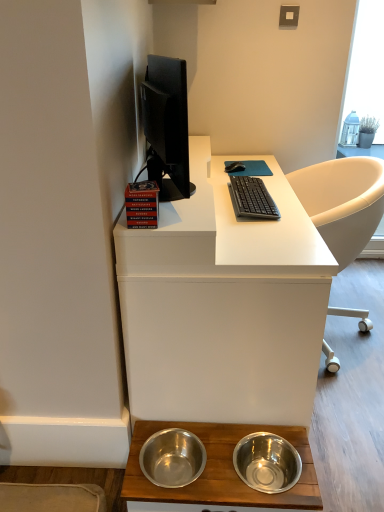
Question: Is black plastic keyboard at center at the right side of black rubber mouse at center?

Choices:
 (A) yes
 (B) no

Answer: (A)

Question: Considering the relative sizes of black plastic keyboard at center and black rubber mouse at center in the image provided, is black plastic keyboard at center smaller than black rubber mouse at center?

Choices:
 (A) yes
 (B) no

Answer: (B)

Question: From a real-world perspective, is black plastic keyboard at center positioned under black rubber mouse at center based on gravity?

Choices:
 (A) no
 (B) yes

Answer: (B)

Question: Does black plastic keyboard at center lie in front of black rubber mouse at center?

Choices:
 (A) no
 (B) yes

Answer: (B)

Question: Are black plastic keyboard at center and black rubber mouse at center located far from each other?

Choices:
 (A) no
 (B) yes

Answer: (A)

Question: In terms of height, does stainless steel bowls at lower center, marked as the 1th desk in a bottom-to-top arrangement, look taller or shorter compared to white matte desk at center, which appears as the first desk when viewed from the top?

Choices:
 (A) short
 (B) tall

Answer: (A)

Question: From a real-world perspective, is stainless steel bowls at lower center, which is the second desk from top to bottom, physically located above or below white matte desk at center, arranged as the 2th desk when ordered from the bottom?

Choices:
 (A) above
 (B) below

Answer: (B)

Question: Relative to white matte desk at center, which appears as the first desk when viewed from the top, is stainless steel bowls at lower center, which is the second desk from top to bottom, in front or behind?

Choices:
 (A) behind
 (B) front

Answer: (A)

Question: Considering the positions of point (148, 431) and point (139, 300), is point (148, 431) closer or farther from the camera than point (139, 300)?

Choices:
 (A) closer
 (B) farther

Answer: (B)

Question: Is white matte desk at center, arranged as the 2th desk when ordered from the bottom, spatially inside stainless steel bowls at lower center, marked as the 1th desk in a bottom-to-top arrangement, or outside of it?

Choices:
 (A) inside
 (B) outside

Answer: (B)

Question: Would you say white matte desk at center, which appears as the first desk when viewed from the top, is to the left or to the right of stainless steel bowls at lower center, marked as the 1th desk in a bottom-to-top arrangement, in the picture?

Choices:
 (A) right
 (B) left

Answer: (A)

Question: Considering the positions of white matte desk at center, arranged as the 2th desk when ordered from the bottom, and stainless steel bowls at lower center, marked as the 1th desk in a bottom-to-top arrangement, in the image, is white matte desk at center, arranged as the 2th desk when ordered from the bottom, taller or shorter than stainless steel bowls at lower center, marked as the 1th desk in a bottom-to-top arrangement,?

Choices:
 (A) tall
 (B) short

Answer: (A)

Question: Is white matte desk at center, which appears as the first desk when viewed from the top, in front of or behind stainless steel bowls at lower center, which is the second desk from top to bottom, in the image?

Choices:
 (A) front
 (B) behind

Answer: (A)

Question: Based on their positions, is white matte desk at center, arranged as the 2th desk when ordered from the bottom, located to the left or right of black plastic keyboard at center?

Choices:
 (A) left
 (B) right

Answer: (A)

Question: From the image's perspective, is white matte desk at center, arranged as the 2th desk when ordered from the bottom, located above or below black plastic keyboard at center?

Choices:
 (A) above
 (B) below

Answer: (B)